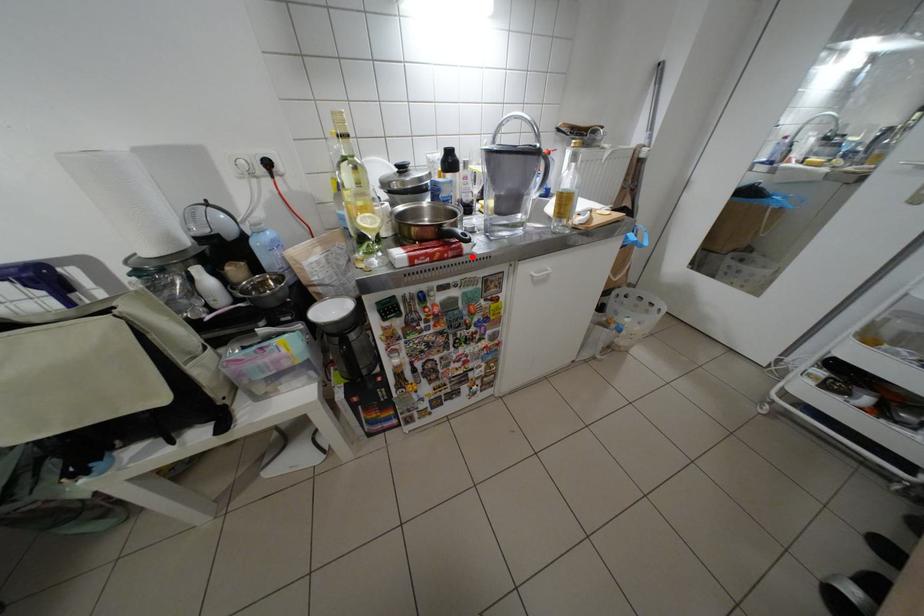
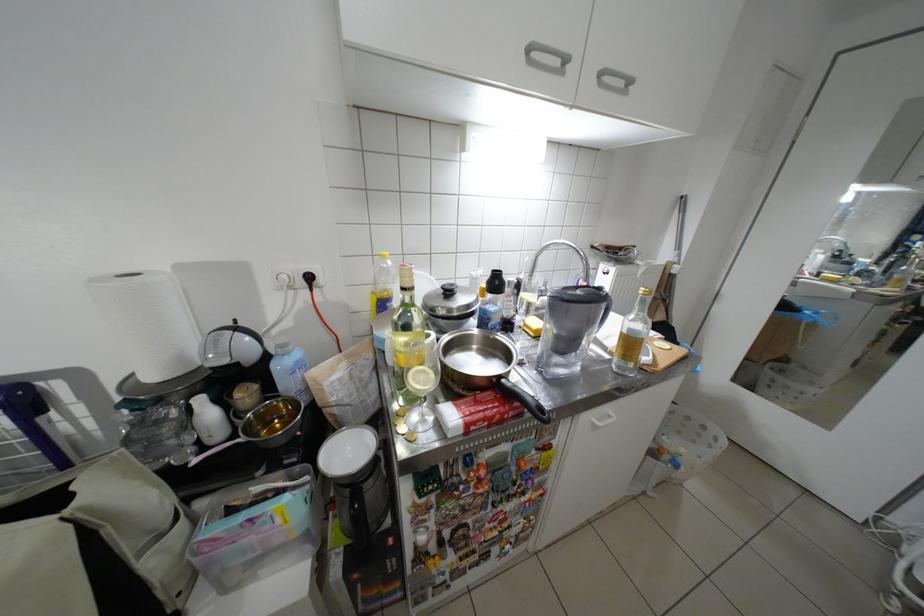
The point at the highlighted location is marked in the first image. Where is the corresponding point in the second image?

(532, 415)